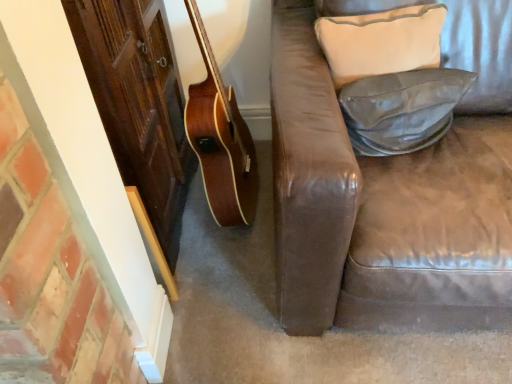
Question: Is beige fabric pillow at upper right, arranged as the 1th pillow when viewed from the top, bigger or smaller than leather-like gray pillow at right, acting as the 2th pillow starting from the top?

Choices:
 (A) big
 (B) small

Answer: (A)

Question: In terms of height, does beige fabric pillow at upper right, arranged as the 1th pillow when viewed from the top, look taller or shorter compared to leather-like gray pillow at right, acting as the 2th pillow starting from the top?

Choices:
 (A) short
 (B) tall

Answer: (B)

Question: From a real-world perspective, is beige fabric pillow at upper right, arranged as the 1th pillow when viewed from the top, physically located above or below leather-like gray pillow at right, acting as the 1th pillow starting from the bottom?

Choices:
 (A) above
 (B) below

Answer: (A)

Question: Does point (403, 132) appear closer or farther from the camera than point (387, 46)?

Choices:
 (A) closer
 (B) farther

Answer: (B)

Question: In the image, is leather-like gray pillow at right, acting as the 1th pillow starting from the bottom, on the left side or the right side of beige fabric pillow at upper right, which appears as the 2th pillow when ordered from the bottom?

Choices:
 (A) left
 (B) right

Answer: (B)

Question: Is leather-like gray pillow at right, acting as the 2th pillow starting from the top, wider or thinner than beige fabric pillow at upper right, arranged as the 1th pillow when viewed from the top?

Choices:
 (A) thin
 (B) wide

Answer: (A)

Question: Is leather-like gray pillow at right, acting as the 1th pillow starting from the bottom, situated inside beige fabric pillow at upper right, which appears as the 2th pillow when ordered from the bottom, or outside?

Choices:
 (A) outside
 (B) inside

Answer: (A)